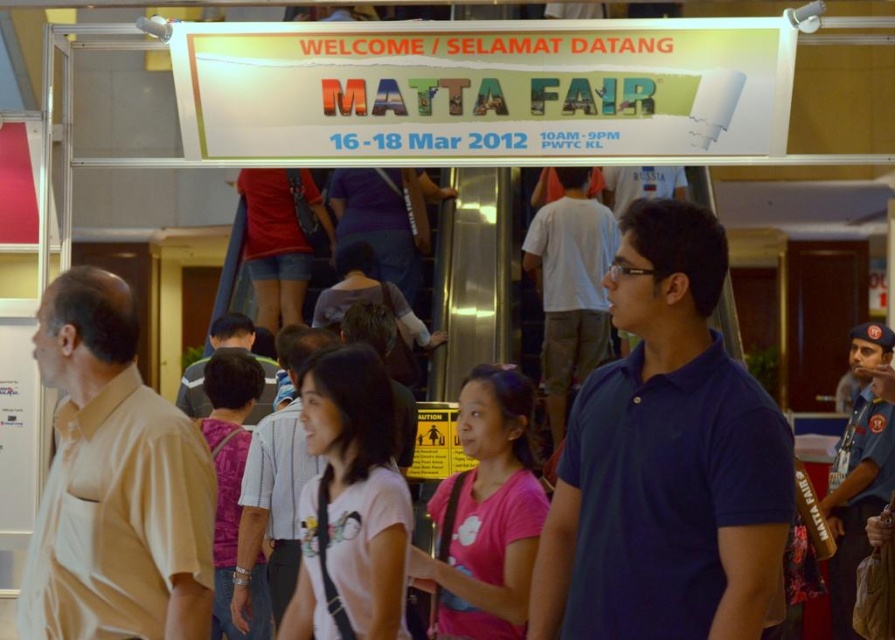
You are attending the Matta Fair and notice two shirts displayed at the entrance. The white cotton shirt at center and the striped shirt at center. Which shirt is positioned lower?

The white cotton shirt at center is positioned lower than the striped shirt at center.

You are a photographer at the Matta Fair entrance and want to take a photo of the white cotton shirt at center and the blue uniform at center. Which one will appear shorter in the photo?

The white cotton shirt at center is not as tall as the blue uniform at center, so it will appear shorter in the photo.